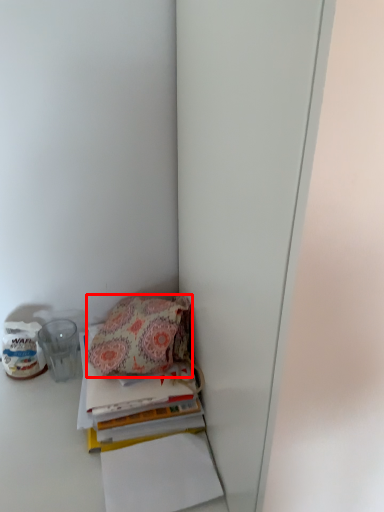
Question: From the image, what is the correct spatial relationship of handbag (annotated by the red box) in relation to paperback book?

Choices:
 (A) right
 (B) left

Answer: (B)